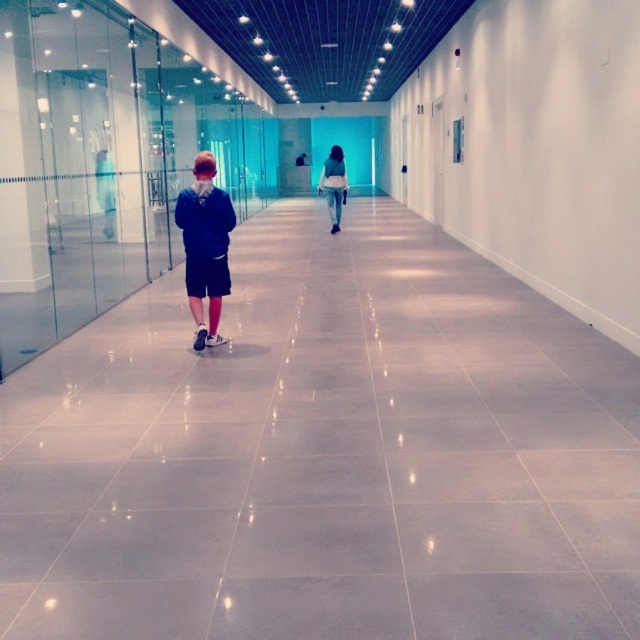
Question: Does matte blue hoodie at center have a lesser width compared to white cotton shirt at center?

Choices:
 (A) no
 (B) yes

Answer: (B)

Question: Is gray tile floor at center to the left of matte blue hoodie at center from the viewer's perspective?

Choices:
 (A) yes
 (B) no

Answer: (B)

Question: Based on their relative distances, which object is farther from the gray tile floor at center?

Choices:
 (A) matte blue hoodie at center
 (B) white cotton shirt at center

Answer: (B)

Question: Which object is closer to the camera taking this photo?

Choices:
 (A) white cotton shirt at center
 (B) gray tile floor at center
 (C) matte blue hoodie at center

Answer: (B)

Question: Which point appears farthest from the camera in this image?

Choices:
 (A) (410, 515)
 (B) (332, 209)

Answer: (B)

Question: Does gray tile floor at center appear on the left side of white cotton shirt at center?

Choices:
 (A) yes
 (B) no

Answer: (B)